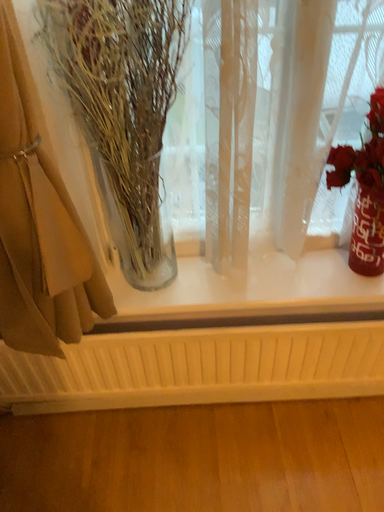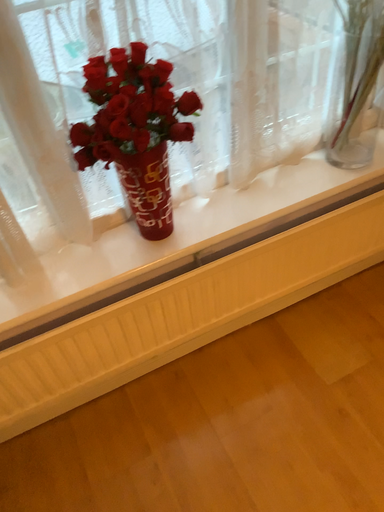
Question: Which way did the camera rotate in the video?

Choices:
 (A) rotated left
 (B) rotated right

Answer: (B)